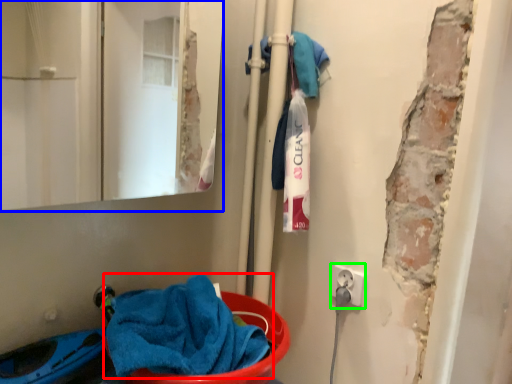
Question: Estimate the real-world distances between objects in this image. Which object is farther from towel (highlighted by a red box), mirror (highlighted by a blue box) or electric outlet (highlighted by a green box)?

Choices:
 (A) mirror
 (B) electric outlet

Answer: (A)